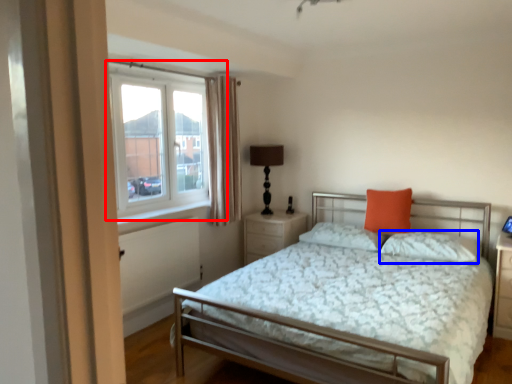
Question: Which object appears farthest to the camera in this image, window (highlighted by a red box) or pillow (highlighted by a blue box)?

Choices:
 (A) window
 (B) pillow

Answer: (B)